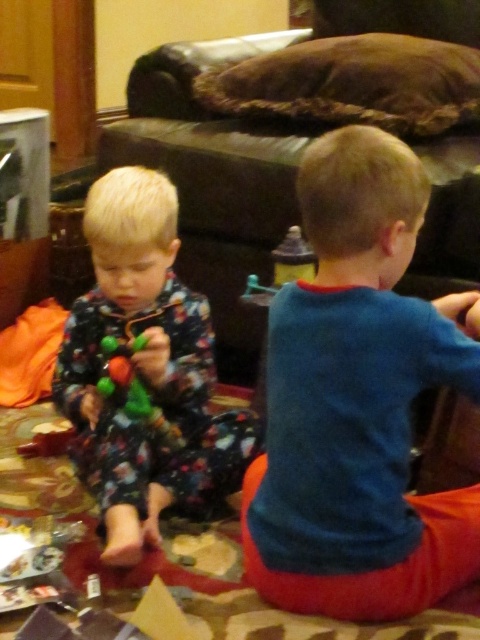
Who is lower down, blue cotton shirt at center or floral pajamas at left?

Positioned lower is blue cotton shirt at center.

Is point (322, 595) in front of point (115, 173)?

Yes, it is.

You are a GUI agent. You are given a task and a screenshot of the screen. Output one action in this format:
    pyautogui.click(x=<x>, y=<y>)
    Task: Click on the blue cotton shirt at center
    The width and height of the screenshot is (480, 640).
    Given the screenshot: What is the action you would take?
    pyautogui.click(x=357, y=403)

Which of these two, blue cotton shirt at center or shiny plastic toy at left, stands shorter?

With less height is shiny plastic toy at left.

What are the coordinates of `blue cotton shirt at center` in the screenshot? It's located at (357, 403).

Which is in front, point (381, 323) or point (171, 432)?

Point (381, 323) is more forward.

I want to click on blue cotton shirt at center, so click(x=357, y=403).

Is floral pajamas at left further to the viewer compared to shiny plastic toy at left?

No.

Is point (190, 348) behind point (140, 339)?

That is True.

Identify the location of floral pajamas at left. This screenshot has height=640, width=480. (144, 371).

The image size is (480, 640). Find the location of `floral pajamas at left`. floral pajamas at left is located at coordinates (144, 371).